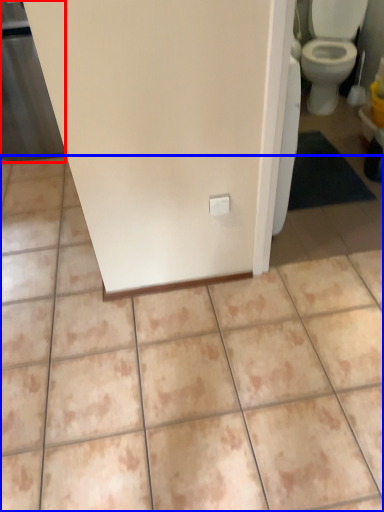
Question: Which object appears farthest to the camera in this image, screen door (highlighted by a red box) or ceramic tile (highlighted by a blue box)?

Choices:
 (A) screen door
 (B) ceramic tile

Answer: (A)